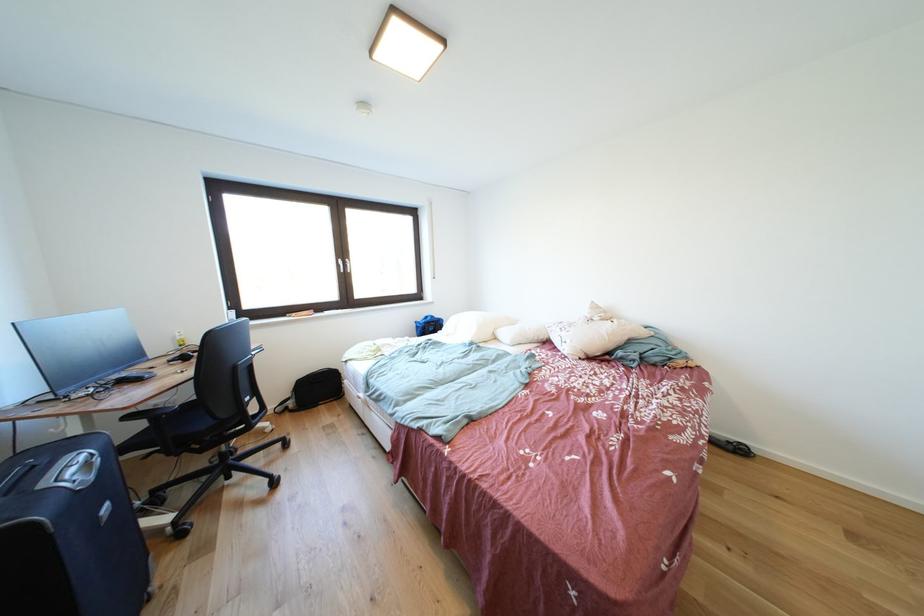
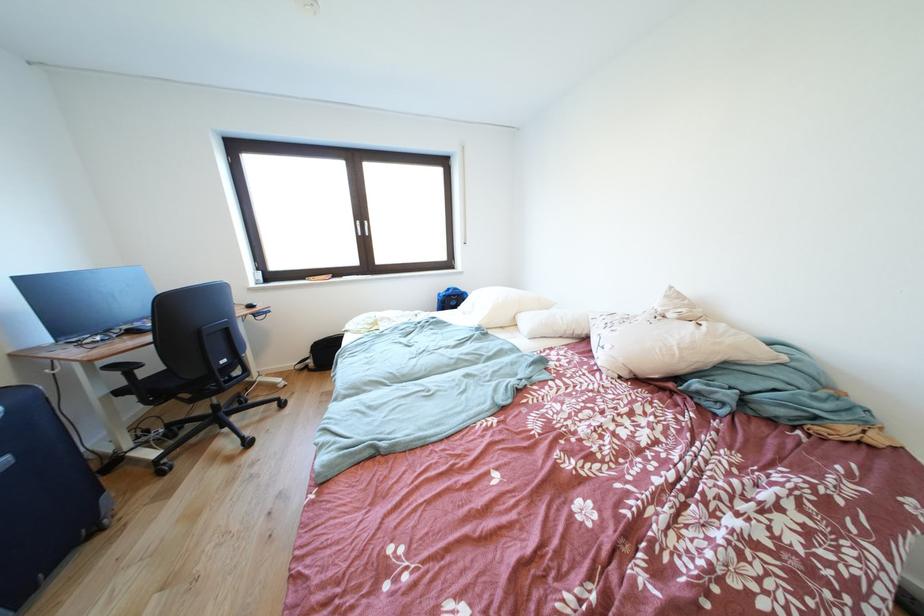
Find the pixel in the second image that matches [348,265] in the first image.

(367, 228)